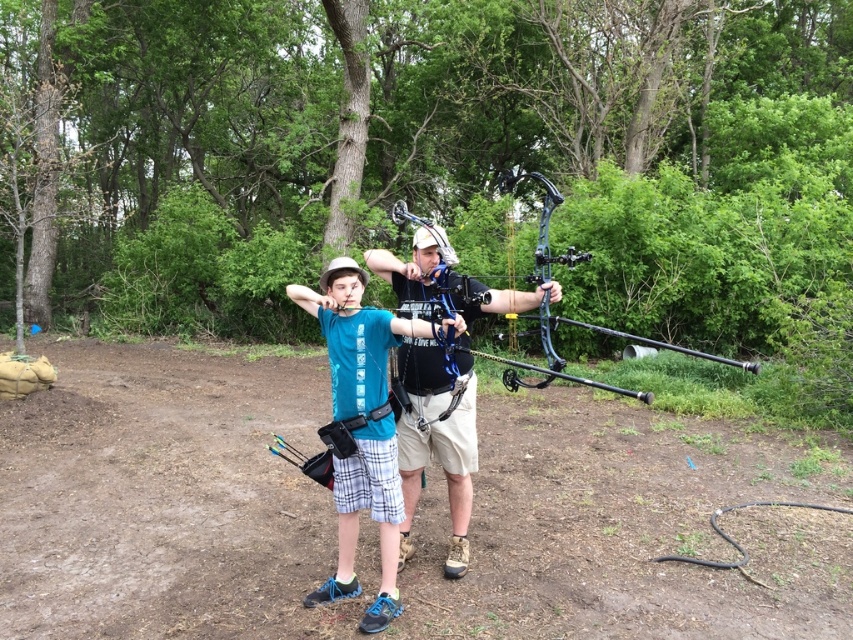
You are an archery instructor observing the scene. You notice the blue fabric shirt at center and the shiny black bow at center. Which object has a narrower width when viewed from the front?

The blue fabric shirt at center is thinner than the shiny black bow at center, so the blue fabric shirt at center has a narrower width when viewed from the front.

From the picture: You are an archery instructor observing the scene. You notice the blue fabric shirt at center and the matte black bow at center. Which object is positioned lower in the image?

The blue fabric shirt at center is located below the matte black bow at center, so the blue fabric shirt at center is positioned lower in the image.

You are an archery instructor observing the scene. You notice two objects at the center of the image. Which one is closer to you, the matte black bow at center or the matte black fishing pole at center?

The matte black bow at center is closer to you because the matte black fishing pole at center is behind it.